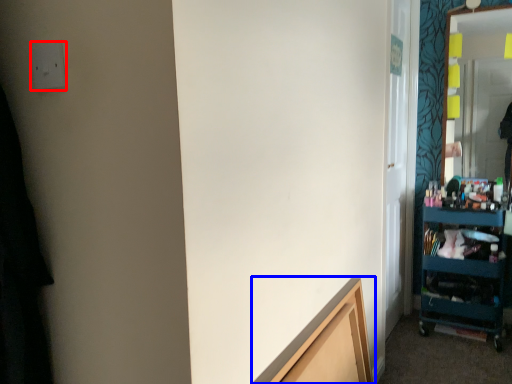
Question: Which object appears farthest to the camera in this image, electric outlet (highlighted by a red box) or cabinetry (highlighted by a blue box)?

Choices:
 (A) electric outlet
 (B) cabinetry

Answer: (B)